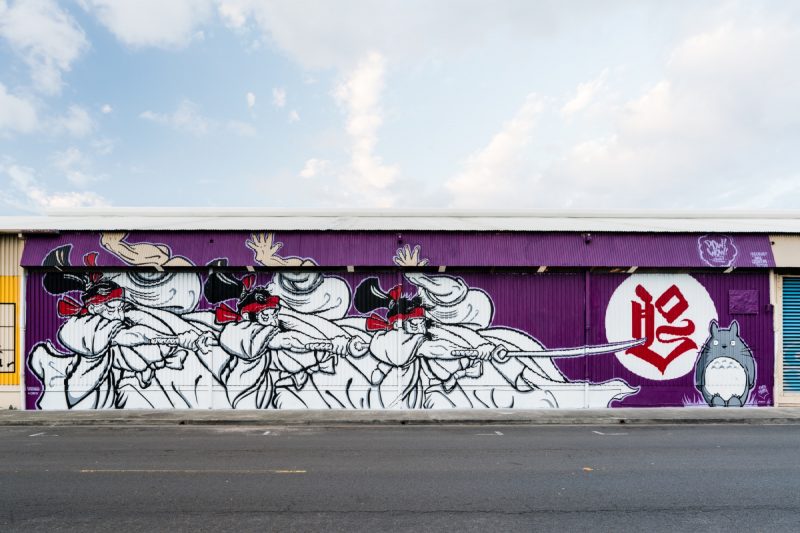
This screenshot has width=800, height=533. Identify the location of wall. (546, 290).